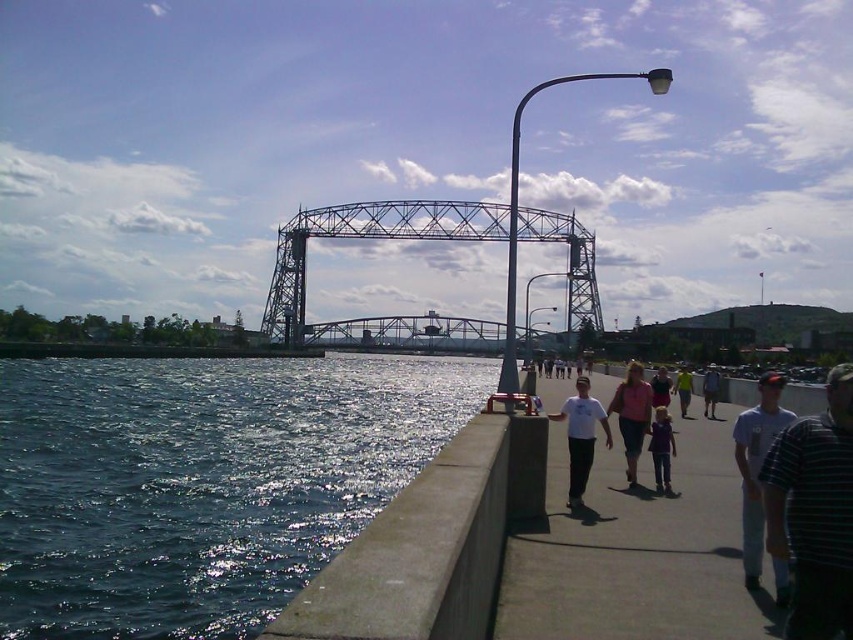
You are a photographer trying to capture both the purple fabric shirt at center and the matte pink shirt at center in a single frame. Given their sizes, which one might you need to position closer to the camera to ensure both appear similarly sized in the photo?

The purple fabric shirt at center is smaller in size compared to the matte pink shirt at center. To make them appear similar in size in the photo, you should position the purple fabric shirt at center closer to the camera while keeping the matte pink shirt at center farther back.

You are standing on the concrete walkway and want to walk towards the steel truss bridge. There are two points marked on the path ahead of you at coordinates point (585, 419) and point (659, 448). Which point should you reach first while moving towards the bridge?

You should reach point (585, 419) first because it is in front of point (659, 448) along the path towards the bridge.